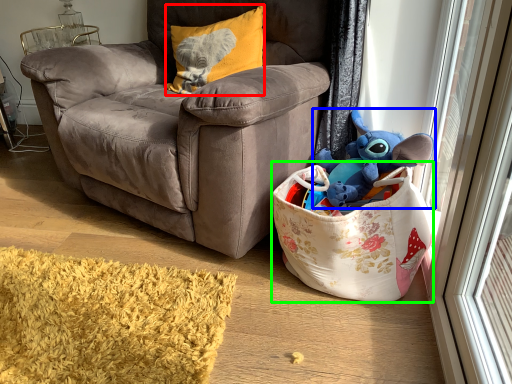
Question: Which is farther away from pillow (highlighted by a red box)? toy (highlighted by a blue box) or gift basket (highlighted by a green box)?

Choices:
 (A) toy
 (B) gift basket

Answer: (B)